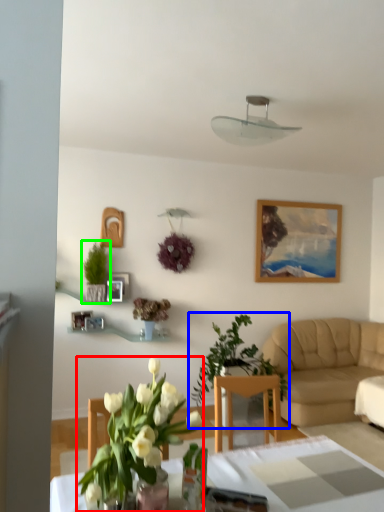
Question: Which object is positioned farthest from houseplant (highlighted by a red box)? Select from houseplant (highlighted by a blue box) and houseplant (highlighted by a green box).

Choices:
 (A) houseplant
 (B) houseplant

Answer: (B)